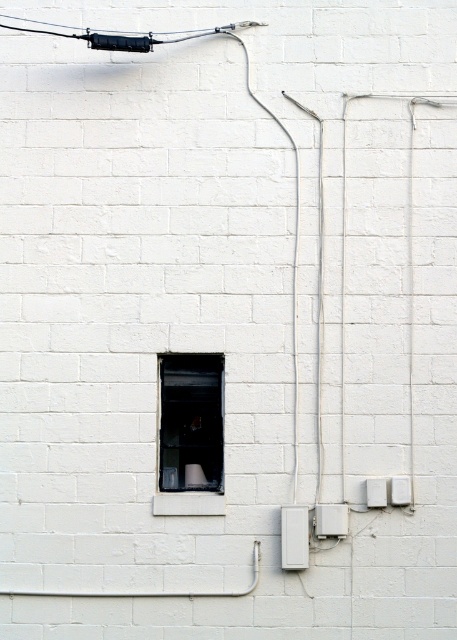
Question: Which object is closer to the camera taking this photo?

Choices:
 (A) white plastic electric outlet at lower right
 (B) transparent glass window at center

Answer: (A)

Question: Can you confirm if transparent glass window at center is positioned to the left of white plastic electric outlet at lower right?

Choices:
 (A) no
 (B) yes

Answer: (B)

Question: Is transparent glass window at center below white plastic electric outlet at lower right?

Choices:
 (A) no
 (B) yes

Answer: (A)

Question: Which point is closer to the camera?

Choices:
 (A) (218, 365)
 (B) (397, 488)

Answer: (B)

Question: Can you confirm if transparent glass window at center is positioned to the right of white plastic electric outlet at lower right?

Choices:
 (A) no
 (B) yes

Answer: (A)